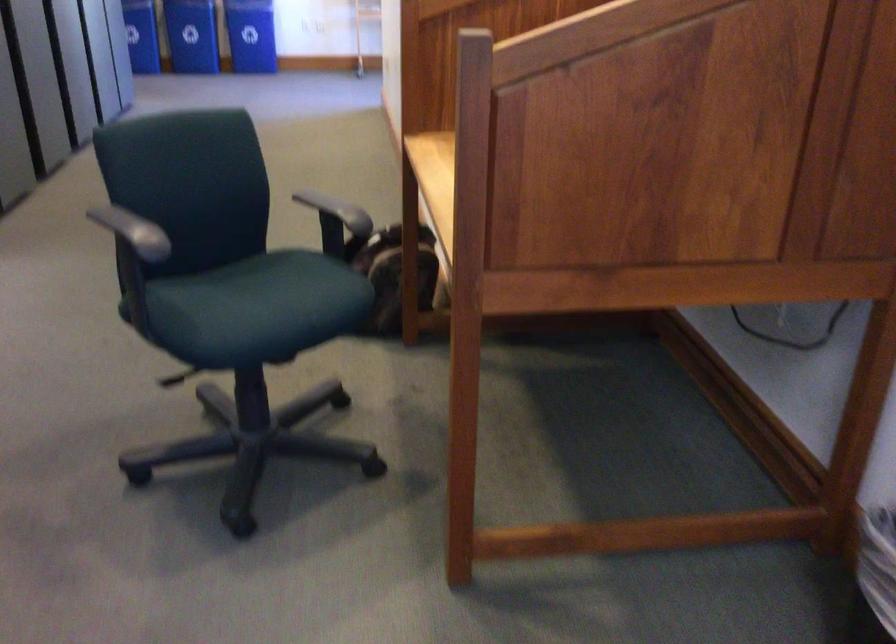
Describe the element at coordinates (134, 227) in the screenshot. The height and width of the screenshot is (644, 896). I see `the grey chair armrest` at that location.